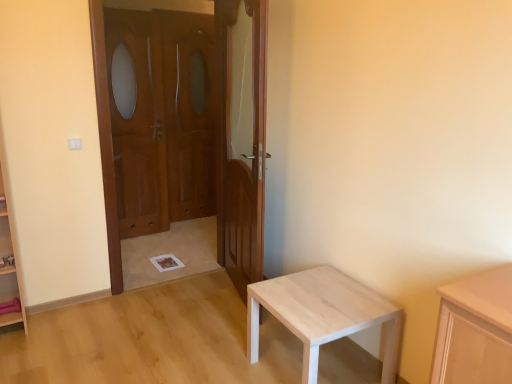
Locate an element on the screen. The image size is (512, 384). vacant area situated to the left side of wooden door at left, placed as the second door when sorted from right to left is located at coordinates (147, 267).